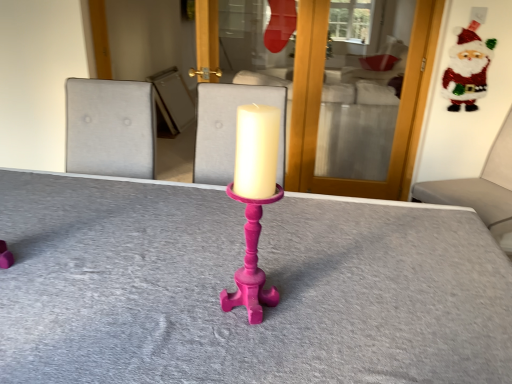
Question: Is matte pink candle holder at center at the right side of shiny glitter santa at upper right?

Choices:
 (A) yes
 (B) no

Answer: (B)

Question: Is matte pink candle holder at center smaller than shiny glitter santa at upper right?

Choices:
 (A) yes
 (B) no

Answer: (A)

Question: Is matte pink candle holder at center wider than shiny glitter santa at upper right?

Choices:
 (A) no
 (B) yes

Answer: (B)

Question: From the image's perspective, does matte pink candle holder at center appear lower than shiny glitter santa at upper right?

Choices:
 (A) no
 (B) yes

Answer: (B)

Question: From a real-world perspective, is matte pink candle holder at center physically below shiny glitter santa at upper right?

Choices:
 (A) no
 (B) yes

Answer: (B)

Question: Is matte pink candle holder at center facing away from shiny glitter santa at upper right?

Choices:
 (A) no
 (B) yes

Answer: (A)

Question: Is matte pink candle holder at center thinner than velvet grey cushion at right?

Choices:
 (A) yes
 (B) no

Answer: (A)

Question: From the image's perspective, does matte pink candle holder at center appear lower than velvet grey cushion at right?

Choices:
 (A) no
 (B) yes

Answer: (B)

Question: From a real-world perspective, is matte pink candle holder at center positioned over velvet grey cushion at right based on gravity?

Choices:
 (A) yes
 (B) no

Answer: (A)

Question: Can you confirm if matte pink candle holder at center is smaller than velvet grey cushion at right?

Choices:
 (A) yes
 (B) no

Answer: (A)

Question: Is matte pink candle holder at center facing towards velvet grey cushion at right?

Choices:
 (A) no
 (B) yes

Answer: (A)

Question: Is matte pink candle holder at center completely or partially outside of velvet grey cushion at right?

Choices:
 (A) yes
 (B) no

Answer: (A)

Question: Is shiny glitter santa at upper right to the right of matte pink candle holder at center from the viewer's perspective?

Choices:
 (A) no
 (B) yes

Answer: (B)